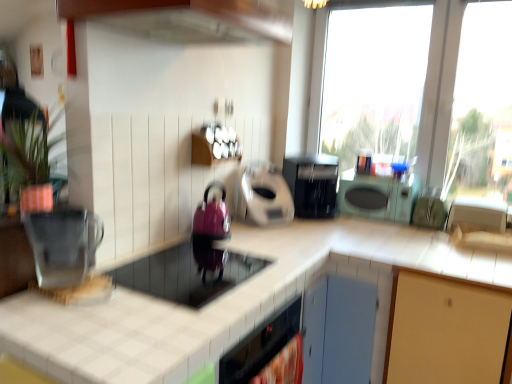
Question: Is black plastic coffee maker at center aimed at metallic silver toaster at right, positioned as the 1th appliance in right-to-left order?

Choices:
 (A) yes
 (B) no

Answer: (B)

Question: Is black plastic coffee maker at center positioned behind metallic silver toaster at right, positioned as the 1th appliance in right-to-left order?

Choices:
 (A) no
 (B) yes

Answer: (B)

Question: Considering the relative sizes of black plastic coffee maker at center and metallic silver toaster at right, positioned as the 1th appliance in right-to-left order, in the image provided, is black plastic coffee maker at center thinner than metallic silver toaster at right, positioned as the 1th appliance in right-to-left order,?

Choices:
 (A) no
 (B) yes

Answer: (A)

Question: Is black plastic coffee maker at center not inside metallic silver toaster at right, the 5th appliance when ordered from left to right?

Choices:
 (A) yes
 (B) no

Answer: (A)

Question: Does black plastic coffee maker at center have a greater width compared to metallic silver toaster at right, positioned as the 1th appliance in right-to-left order?

Choices:
 (A) no
 (B) yes

Answer: (B)

Question: Considering the positions of green matte plant at upper left and transparent glass window at upper right in the image, is green matte plant at upper left taller or shorter than transparent glass window at upper right?

Choices:
 (A) short
 (B) tall

Answer: (A)

Question: From the image's perspective, is green matte plant at upper left located above or below transparent glass window at upper right?

Choices:
 (A) above
 (B) below

Answer: (B)

Question: From a real-world perspective, is green matte plant at upper left positioned above or below transparent glass window at upper right?

Choices:
 (A) above
 (B) below

Answer: (B)

Question: Relative to transparent glass window at upper right, is green matte plant at upper left in front or behind?

Choices:
 (A) behind
 (B) front

Answer: (B)

Question: Does point (323, 258) appear closer or farther from the camera than point (348, 203)?

Choices:
 (A) closer
 (B) farther

Answer: (A)

Question: From the image's perspective, is beige tile countertop at center located above or below green matte microwave at center?

Choices:
 (A) above
 (B) below

Answer: (B)

Question: Considering the positions of beige tile countertop at center and green matte microwave at center in the image, is beige tile countertop at center taller or shorter than green matte microwave at center?

Choices:
 (A) short
 (B) tall

Answer: (B)

Question: Is beige tile countertop at center in front of or behind green matte microwave at center in the image?

Choices:
 (A) behind
 (B) front

Answer: (B)

Question: From a real-world perspective, is transparent glass window at upper right physically located above or below metallic silver kettle at left, which is the first appliance from left to right?

Choices:
 (A) above
 (B) below

Answer: (A)

Question: From the image's perspective, is transparent glass window at upper right positioned above or below metallic silver kettle at left, marked as the 5th appliance in a right-to-left arrangement?

Choices:
 (A) below
 (B) above

Answer: (B)